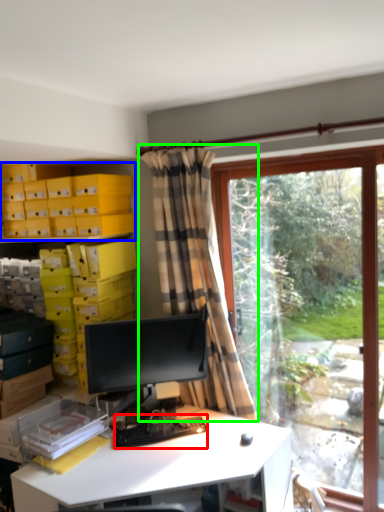
Question: Which is nearer to the computer keyboard (highlighted by a red box)? shelf (highlighted by a blue box) or curtain (highlighted by a green box).

Choices:
 (A) shelf
 (B) curtain

Answer: (B)